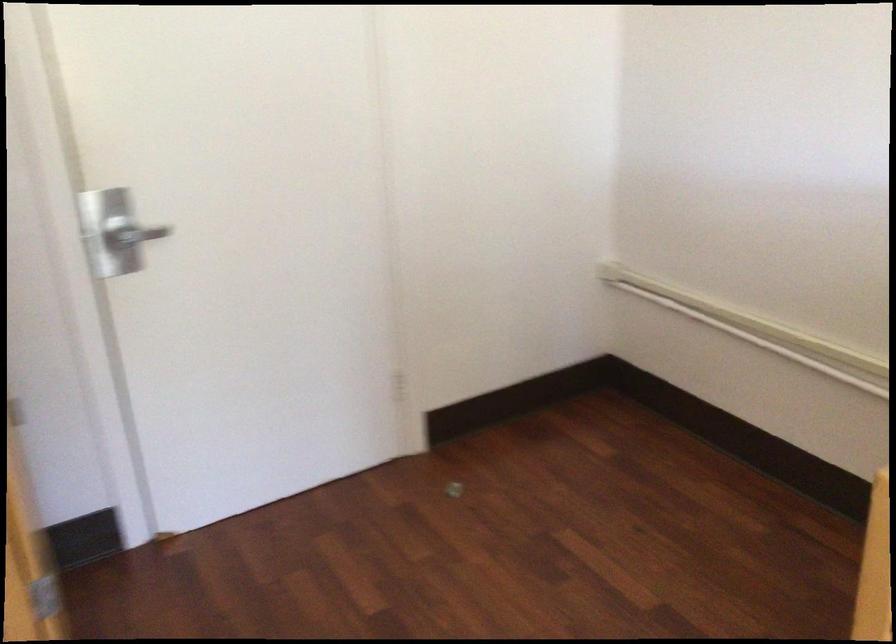
Where would you pull the silver door handle? Please return your answer as a coordinate pair (x, y).

(133, 234)